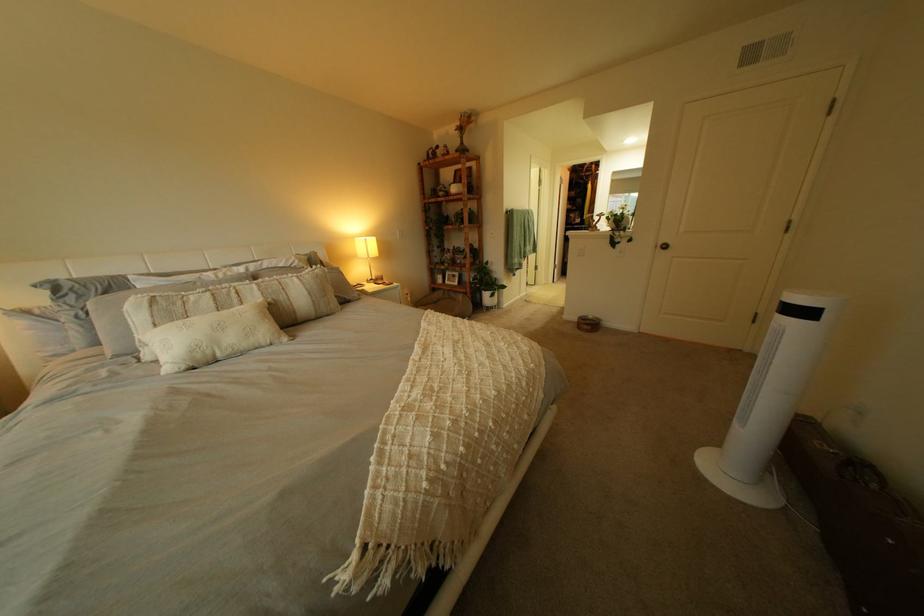
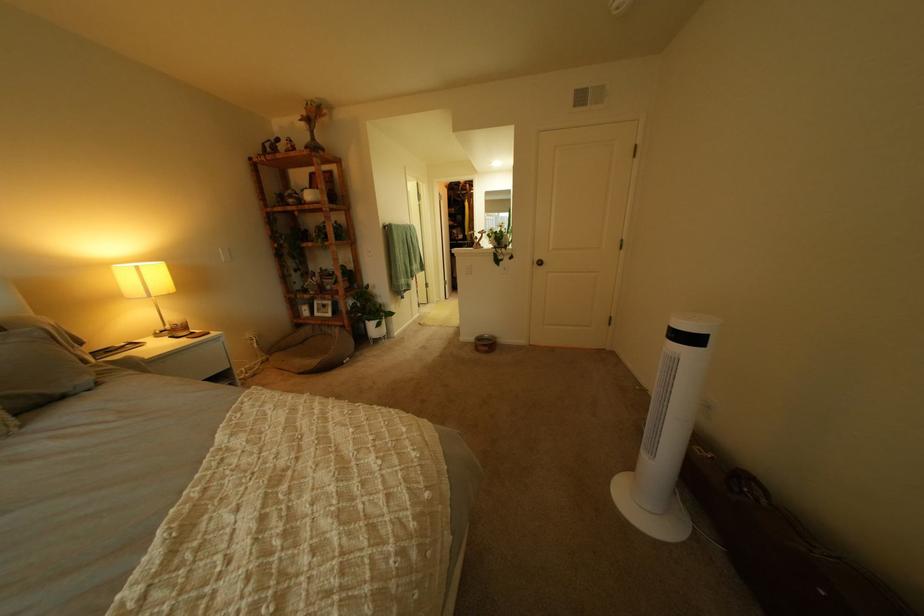
The point at (591, 320) is marked in the first image. Where is the corresponding point in the second image?

(489, 339)